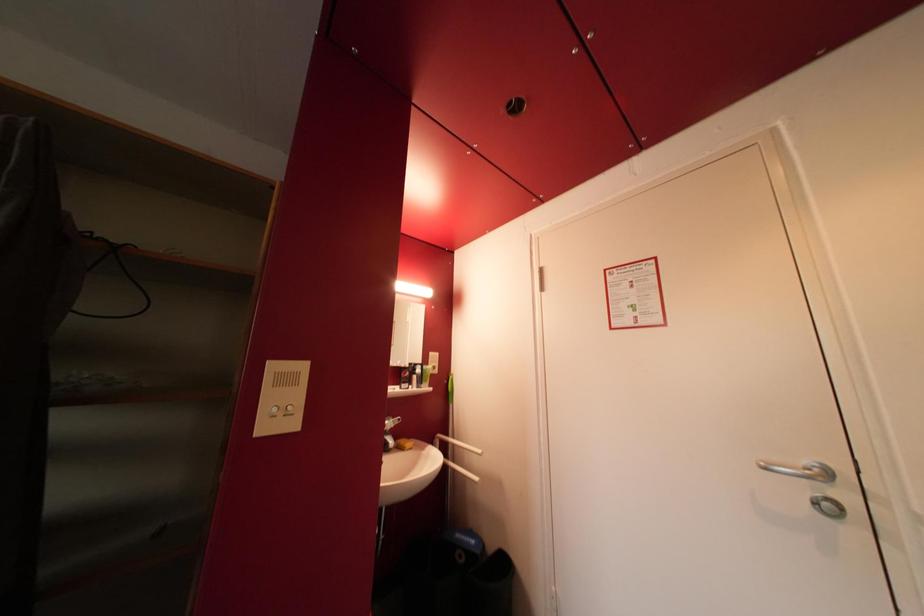
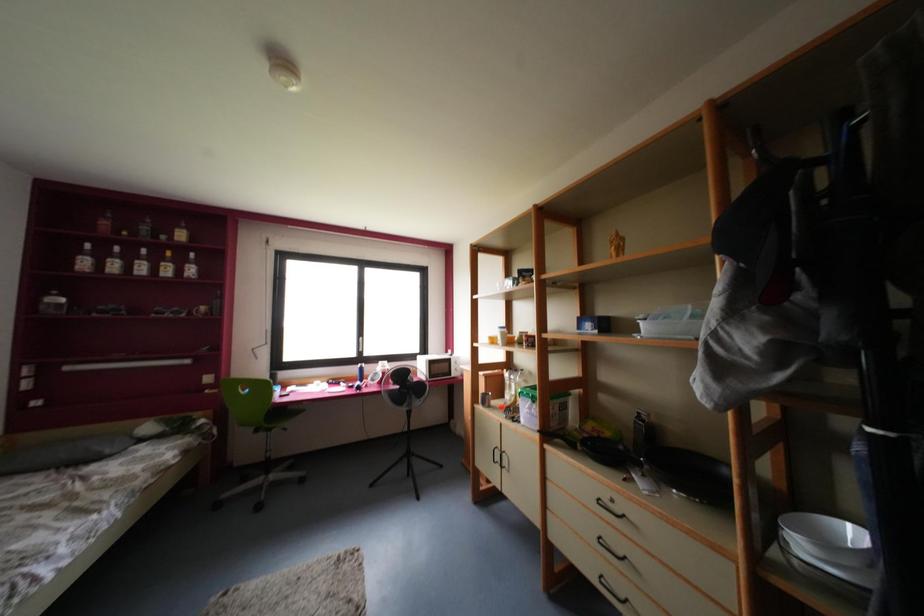
Question: How did the camera likely rotate?

Choices:
 (A) Left
 (B) Right
 (C) Up
 (D) Down

Answer: (A)